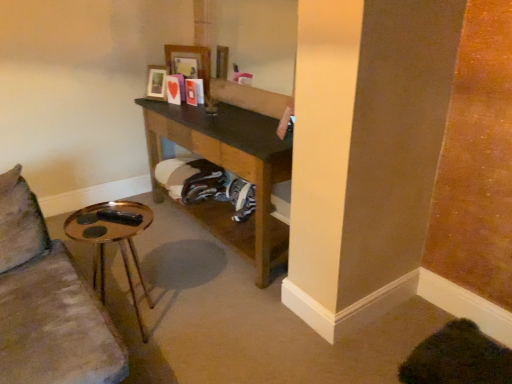
Identify the location of vacant space underneath gold metallic side table at lower left (from a real-world perspective). (137, 324).